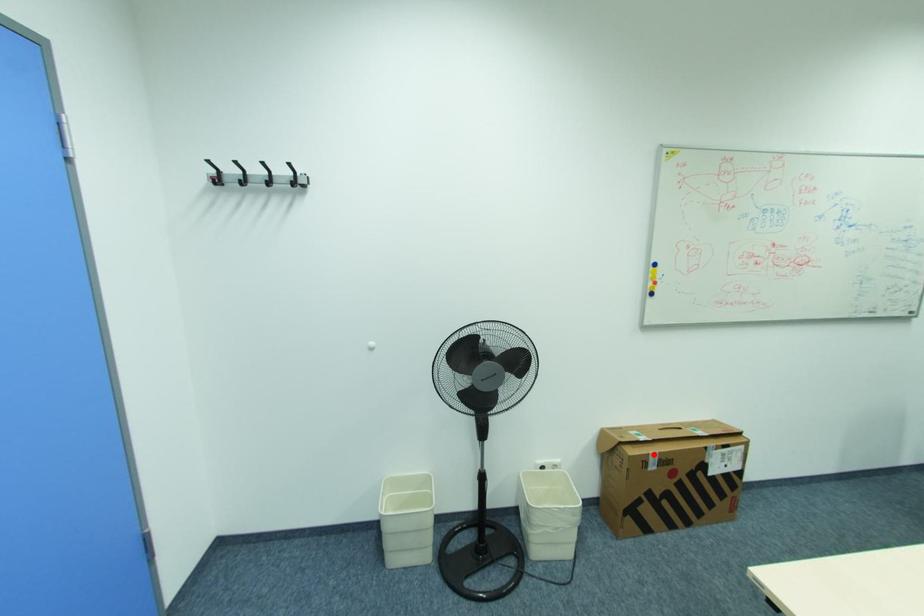
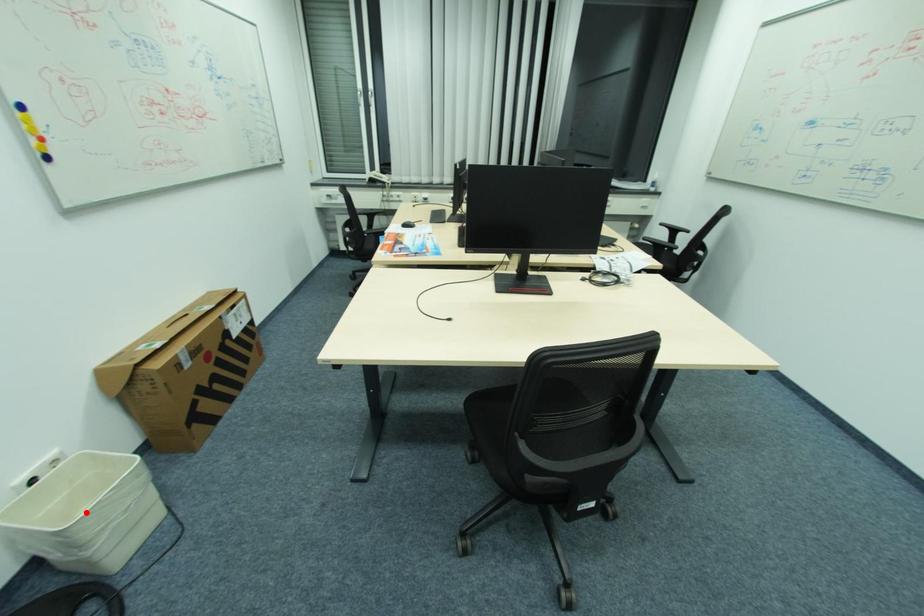
I am providing you with two images of the same scene from different viewpoints. A red point is marked on the first image and another point is marked on the second image. Does the point marked in image1 correspond to the same location as the one in image2?

No